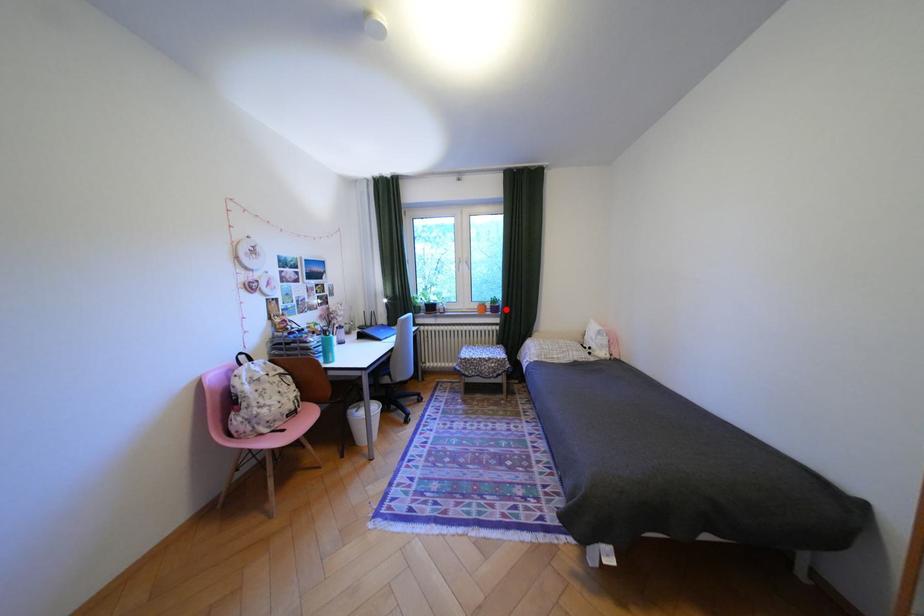
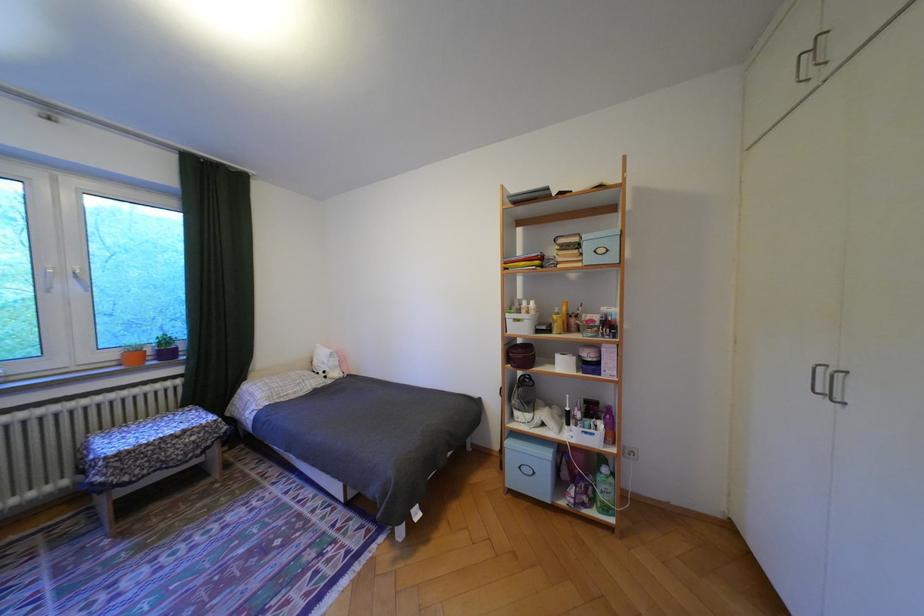
Find the pixel in the second image that matches the highlighted location in the first image.

(178, 354)